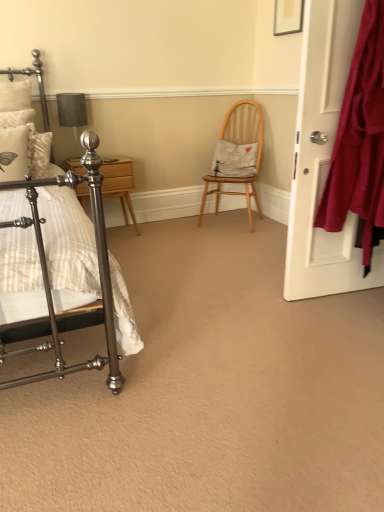
Question: Visually, is matte white door at right positioned to the left or to the right of polished wood nightstand at left?

Choices:
 (A) right
 (B) left

Answer: (A)

Question: Is point (324, 92) closer or farther from the camera than point (105, 170)?

Choices:
 (A) farther
 (B) closer

Answer: (B)

Question: Which is farther from the matte gray fabric at upper left?

Choices:
 (A) polished metal bed at left
 (B) white fabric pillow at center, marked as the first pillow in a right-to-left arrangement
 (C) wooden chair at center
 (D) matte white door at right
 (E) polished wood nightstand at left

Answer: (D)

Question: Which is farther from the polished metal bed at left?

Choices:
 (A) matte gray fabric at upper left
 (B) white textured pillow at left, which is the second pillow in right-to-left order
 (C) polished wood nightstand at left
 (D) white fabric pillow at center, which is the second pillow in left-to-right order
 (E) wooden chair at center

Answer: (D)